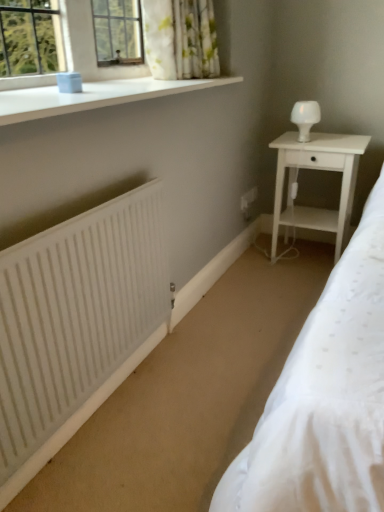
Question: Relative to white glossy table lamp at upper right, is white matte radiator at lower left in front or behind?

Choices:
 (A) front
 (B) behind

Answer: (A)

Question: Looking at the image, does white matte radiator at lower left seem bigger or smaller compared to white glossy table lamp at upper right?

Choices:
 (A) small
 (B) big

Answer: (B)

Question: Estimate the real-world distances between objects in this image. Which object is closer to the white glossy table lamp at upper right?

Choices:
 (A) white wood nightstand at right
 (B) white smooth window sill at upper left
 (C) white matte radiator at lower left

Answer: (A)

Question: Which object is the closest to the white matte radiator at lower left?

Choices:
 (A) white smooth window sill at upper left
 (B) white glossy table lamp at upper right
 (C) white wood nightstand at right

Answer: (A)